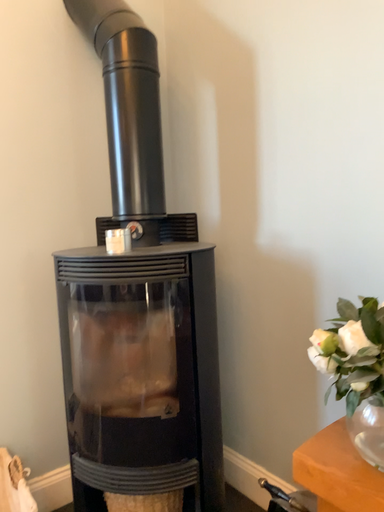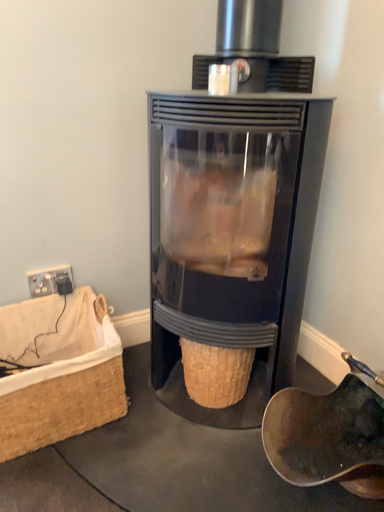
Question: How did the camera likely rotate when shooting the video?

Choices:
 (A) rotated downward
 (B) rotated upward

Answer: (A)